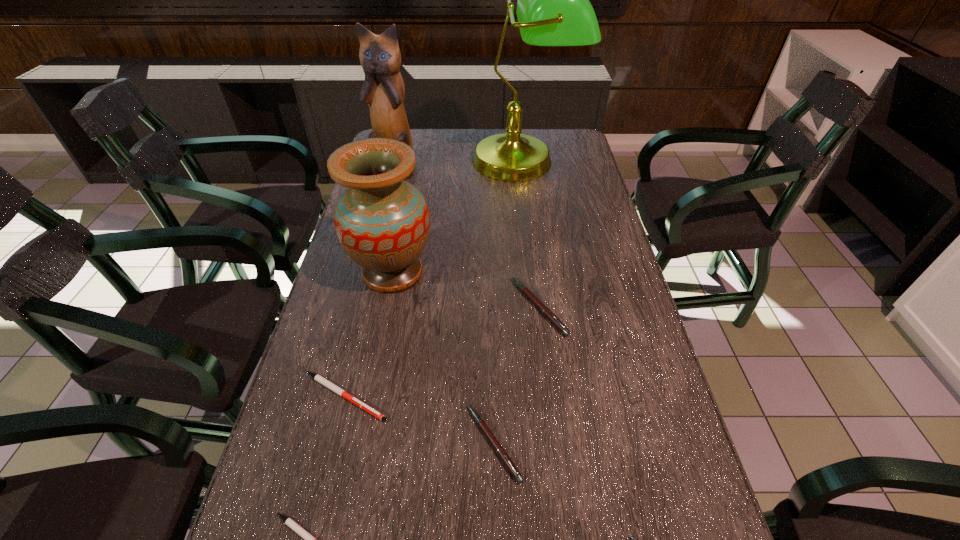
Find the location of a particular element. This screenshot has height=540, width=960. vacant space situated on the face of the cat is located at coordinates tap(384, 209).

Where is `vacant area situated on the back of the vase`? The height and width of the screenshot is (540, 960). vacant area situated on the back of the vase is located at coordinates (406, 208).

The height and width of the screenshot is (540, 960). Identify the location of vacant area situated at the nib of the second pink pen from right to left. (382, 307).

Identify the location of vacant area situated 0.160m at the nib of the second pink pen from right to left. The height and width of the screenshot is (540, 960). (449, 307).

Locate an element on the screen. vacant space located at the nib of the second pink pen from right to left is located at coordinates (418, 307).

Identify the location of vacant space located at the nib of the second smallest pink pen. The height and width of the screenshot is (540, 960). (319, 443).

The height and width of the screenshot is (540, 960). What are the coordinates of `vacant space situated 0.170m at the nib of the second smallest pink pen` in the screenshot? It's located at (380, 443).

In order to click on blank area located 0.120m at the nib of the second smallest pink pen in this screenshot , I will do `click(406, 443)`.

Locate an element on the screen. vacant area situated on the clicker of the farther white pen is located at coordinates (415, 396).

Where is `lamp at the far edge`? This screenshot has width=960, height=540. lamp at the far edge is located at coordinates pyautogui.click(x=553, y=9).